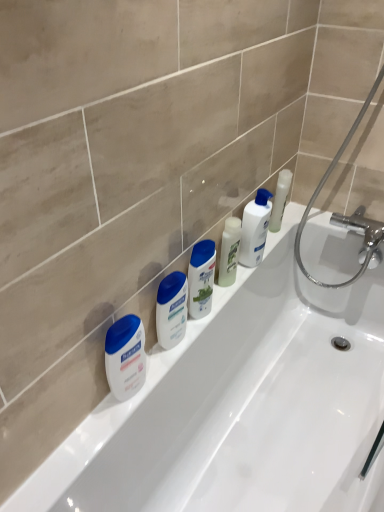
The width and height of the screenshot is (384, 512). What are the coordinates of `white glossy bathtub at center` in the screenshot? It's located at (240, 406).

What do you see at coordinates (229, 251) in the screenshot? The height and width of the screenshot is (512, 384). I see `green matte bottle at center` at bounding box center [229, 251].

The image size is (384, 512). In order to click on chrome metallic shower at upper right in this screenshot , I will do `click(346, 216)`.

What do you see at coordinates (171, 309) in the screenshot? This screenshot has width=384, height=512. I see `white glossy lotion at center, the 1th toiletry in the left-to-right sequence` at bounding box center [171, 309].

The height and width of the screenshot is (512, 384). I want to click on white glossy lotion at upper center, acting as the first toiletry starting from the right, so [255, 228].

Who is more distant, white glossy bathtub at center or white glossy lotion at upper center, acting as the first toiletry starting from the right?

white glossy lotion at upper center, acting as the first toiletry starting from the right.

From the white glossy bathtub at center, count 3rd toiletrys backward and point to it. Please provide its 2D coordinates.

[(255, 228)]

Are white glossy bathtub at center and white glossy lotion at upper center, acting as the first toiletry starting from the right, located far from each other?

No, white glossy bathtub at center is in close proximity to white glossy lotion at upper center, acting as the first toiletry starting from the right.

Is white glossy bathtub at center smaller than white glossy lotion at upper center, which appears as the 3th toiletry when viewed from the left?

Incorrect, white glossy bathtub at center is not smaller in size than white glossy lotion at upper center, which appears as the 3th toiletry when viewed from the left.

From a real-world perspective, does white plastic shampoo bottle at center, positioned as the 2th toiletry in left-to-right order, sit lower than white glossy lotion at center, the 1th toiletry in the left-to-right sequence?

No, from a real-world perspective, white plastic shampoo bottle at center, positioned as the 2th toiletry in left-to-right order, is not below white glossy lotion at center, the 1th toiletry in the left-to-right sequence.

Is white plastic shampoo bottle at center, the 2th toiletry in the right-to-left sequence, to the right of white glossy lotion at center, the 1th toiletry in the left-to-right sequence, from the viewer's perspective?

Indeed, white plastic shampoo bottle at center, the 2th toiletry in the right-to-left sequence, is positioned on the right side of white glossy lotion at center, the 1th toiletry in the left-to-right sequence.

How far apart are white plastic shampoo bottle at center, the 2th toiletry in the right-to-left sequence, and white glossy lotion at center, the 1th toiletry in the left-to-right sequence?

They are 2.96 inches apart.

Is white plastic shampoo bottle at center, the 2th toiletry in the right-to-left sequence, facing towards white glossy lotion at center, which is counted as the third toiletry, starting from the right?

No, white plastic shampoo bottle at center, the 2th toiletry in the right-to-left sequence, is not oriented towards white glossy lotion at center, which is counted as the third toiletry, starting from the right.

From the image's perspective, which one is positioned higher, white glossy lotion at upper center, acting as the first toiletry starting from the right, or white matte lotion at left?

white glossy lotion at upper center, acting as the first toiletry starting from the right, is shown above in the image.

Is point (255, 212) farther from viewer compared to point (135, 320)?

Yes, point (255, 212) is farther from viewer.

Is white glossy lotion at upper center, which appears as the 3th toiletry when viewed from the left, far from white matte lotion at left?

No, white glossy lotion at upper center, which appears as the 3th toiletry when viewed from the left, is not far from white matte lotion at left.

Visually, is white glossy lotion at upper center, acting as the first toiletry starting from the right, positioned to the left or to the right of white matte lotion at left?

From the image, it's evident that white glossy lotion at upper center, acting as the first toiletry starting from the right, is to the right of white matte lotion at left.

Does white glossy lotion at upper center, acting as the first toiletry starting from the right, have a larger size compared to green matte bottle at center?

Yes.

Can you tell me how much white glossy lotion at upper center, acting as the first toiletry starting from the right, and green matte bottle at center differ in facing direction?

The facing directions of white glossy lotion at upper center, acting as the first toiletry starting from the right, and green matte bottle at center are 0.00392 degrees apart.

Between white glossy lotion at upper center, which appears as the 3th toiletry when viewed from the left, and green matte bottle at center, which one appears on the right side from the viewer's perspective?

white glossy lotion at upper center, which appears as the 3th toiletry when viewed from the left.

Between white glossy lotion at upper center, which appears as the 3th toiletry when viewed from the left, and green matte bottle at center, which one has more height?

white glossy lotion at upper center, which appears as the 3th toiletry when viewed from the left, is taller.

Can you confirm if white glossy lotion at upper center, acting as the first toiletry starting from the right, is positioned to the right of white glossy lotion at center, the 1th toiletry in the left-to-right sequence?

Correct, you'll find white glossy lotion at upper center, acting as the first toiletry starting from the right, to the right of white glossy lotion at center, the 1th toiletry in the left-to-right sequence.

Considering the sizes of white glossy lotion at upper center, acting as the first toiletry starting from the right, and white glossy lotion at center, which is counted as the third toiletry, starting from the right, in the image, is white glossy lotion at upper center, acting as the first toiletry starting from the right, bigger or smaller than white glossy lotion at center, which is counted as the third toiletry, starting from the right,?

In the image, white glossy lotion at upper center, acting as the first toiletry starting from the right, appears to be larger than white glossy lotion at center, which is counted as the third toiletry, starting from the right.

Can white glossy lotion at center, which is counted as the third toiletry, starting from the right, be found inside white glossy lotion at upper center, which appears as the 3th toiletry when viewed from the left?

No, white glossy lotion at center, which is counted as the third toiletry, starting from the right, is not a part of white glossy lotion at upper center, which appears as the 3th toiletry when viewed from the left.

Which is more to the left, white glossy lotion at center, which is counted as the third toiletry, starting from the right, or green matte bottle at center?

Positioned to the left is white glossy lotion at center, which is counted as the third toiletry, starting from the right.

Identify the location of mouthwash located above the white glossy lotion at center, which is counted as the third toiletry, starting from the right (from a real-world perspective). (229, 251).

How different are the orientations of white glossy lotion at center, which is counted as the third toiletry, starting from the right, and green matte bottle at center in degrees?

0.00514 degrees.

Is white glossy lotion at center, the 1th toiletry in the left-to-right sequence, spatially inside green matte bottle at center, or outside of it?

white glossy lotion at center, the 1th toiletry in the left-to-right sequence, is spatially situated outside green matte bottle at center.

Can you confirm if white plastic shampoo bottle at center, the 2th toiletry in the right-to-left sequence, is wider than green matte bottle at center?

Indeed, white plastic shampoo bottle at center, the 2th toiletry in the right-to-left sequence, has a greater width compared to green matte bottle at center.

Looking at this image, is white plastic shampoo bottle at center, the 2th toiletry in the right-to-left sequence, not inside green matte bottle at center?

white plastic shampoo bottle at center, the 2th toiletry in the right-to-left sequence, is positioned outside green matte bottle at center.

Can you tell me how much white plastic shampoo bottle at center, positioned as the 2th toiletry in left-to-right order, and green matte bottle at center differ in facing direction?

The angular difference between white plastic shampoo bottle at center, positioned as the 2th toiletry in left-to-right order, and green matte bottle at center is 0.00144 degrees.

How distant is white plastic shampoo bottle at center, positioned as the 2th toiletry in left-to-right order, from green matte bottle at center?

white plastic shampoo bottle at center, positioned as the 2th toiletry in left-to-right order, is 12.78 centimeters from green matte bottle at center.

Where is `bathtub in front of the white glossy lotion at upper center, which appears as the 3th toiletry when viewed from the left`? bathtub in front of the white glossy lotion at upper center, which appears as the 3th toiletry when viewed from the left is located at coordinates (240, 406).

Locate an element on the screen. This screenshot has width=384, height=512. toiletry below the white plastic shampoo bottle at center, the 2th toiletry in the right-to-left sequence (from a real-world perspective) is located at coordinates (171, 309).

When comparing their distances from green matte bottle at center, does chrome metallic shower at upper right or white glossy bathtub at center seem further?

The object further to green matte bottle at center is chrome metallic shower at upper right.

Considering their positions, is white glossy lotion at upper center, which appears as the 3th toiletry when viewed from the left, positioned further to green matte bottle at center than white glossy bathtub at center?

Among the two, white glossy bathtub at center is located further to green matte bottle at center.

When comparing their distances from chrome metallic shower at upper right, does green matte bottle at center or white glossy lotion at center, the 1th toiletry in the left-to-right sequence, seem further?

Based on the image, white glossy lotion at center, the 1th toiletry in the left-to-right sequence, appears to be further to chrome metallic shower at upper right.

Which object lies nearer to the anchor point white glossy lotion at center, the 1th toiletry in the left-to-right sequence, white plastic shampoo bottle at center, positioned as the 2th toiletry in left-to-right order, or white glossy bathtub at center?

Among the two, white plastic shampoo bottle at center, positioned as the 2th toiletry in left-to-right order, is located nearer to white glossy lotion at center, the 1th toiletry in the left-to-right sequence.

Based on their spatial positions, is white plastic shampoo bottle at center, the 2th toiletry in the right-to-left sequence, or white glossy bathtub at center closer to chrome metallic shower at upper right?

Among the two, white glossy bathtub at center is located nearer to chrome metallic shower at upper right.

Estimate the real-world distances between objects in this image. Which object is closer to green matte bottle at center, chrome metallic shower at upper right or white plastic shampoo bottle at center, the 2th toiletry in the right-to-left sequence?

white plastic shampoo bottle at center, the 2th toiletry in the right-to-left sequence, is closer to green matte bottle at center.

From the image, which object appears to be farther from white glossy bathtub at center, chrome metallic shower at upper right or white glossy lotion at upper center, acting as the first toiletry starting from the right?

chrome metallic shower at upper right is positioned further to the anchor white glossy bathtub at center.

Estimate the real-world distances between objects in this image. Which object is further from white plastic shampoo bottle at center, the 2th toiletry in the right-to-left sequence, green matte bottle at center or white matte lotion at left?

white matte lotion at left.

The image size is (384, 512). In order to click on toiletry between white glossy bathtub at center and white plastic shampoo bottle at center, the 2th toiletry in the right-to-left sequence, in the front-back direction in this screenshot , I will do `click(171, 309)`.

This screenshot has width=384, height=512. Identify the location of mouthwash between white plastic shampoo bottle at center, the 2th toiletry in the right-to-left sequence, and white glossy lotion at upper center, which appears as the 3th toiletry when viewed from the left, in the front-back direction. (229, 251).

Locate an element on the screen. This screenshot has height=512, width=384. toiletry between green matte bottle at center and chrome metallic shower at upper right is located at coordinates (255, 228).

In order to click on toiletry between white glossy lotion at center, the 1th toiletry in the left-to-right sequence, and white glossy lotion at upper center, which appears as the 3th toiletry when viewed from the left, along the z-axis in this screenshot , I will do `click(201, 278)`.